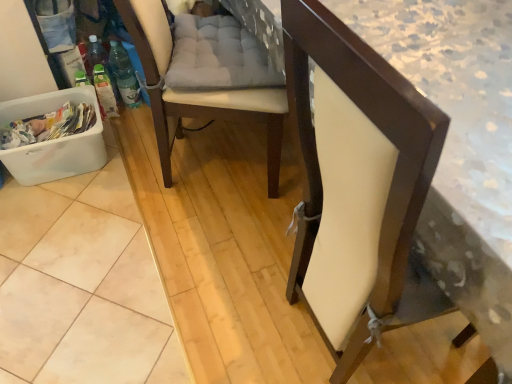
Question: In the image, is white plastic laundry basket at lower left positioned in front of or behind white leather chair at center, which is the first chair from left to right?

Choices:
 (A) front
 (B) behind

Answer: (B)

Question: Is point (92, 135) closer or farther from the camera than point (179, 112)?

Choices:
 (A) closer
 (B) farther

Answer: (B)

Question: Which object is the closest to the white leather chair at center, which is the second chair from right to left?

Choices:
 (A) white plastic laundry basket at lower left
 (B) matte white chair at center, the 2th chair in the left-to-right sequence

Answer: (A)

Question: Which object is positioned closest to the white plastic laundry basket at lower left?

Choices:
 (A) matte white chair at center, which is the 1th chair in right-to-left order
 (B) white leather chair at center, which is the second chair from right to left

Answer: (B)